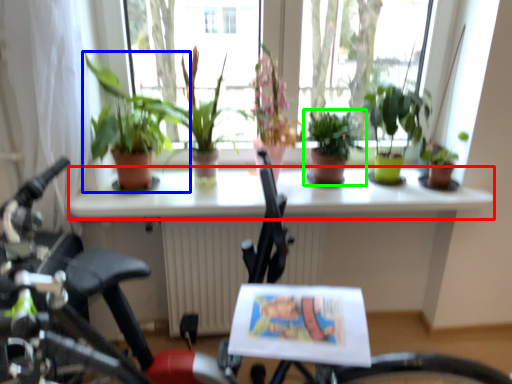
Question: Which is farther away from window sill (highlighted by a red box)? houseplant (highlighted by a blue box) or houseplant (highlighted by a green box)?

Choices:
 (A) houseplant
 (B) houseplant

Answer: (A)